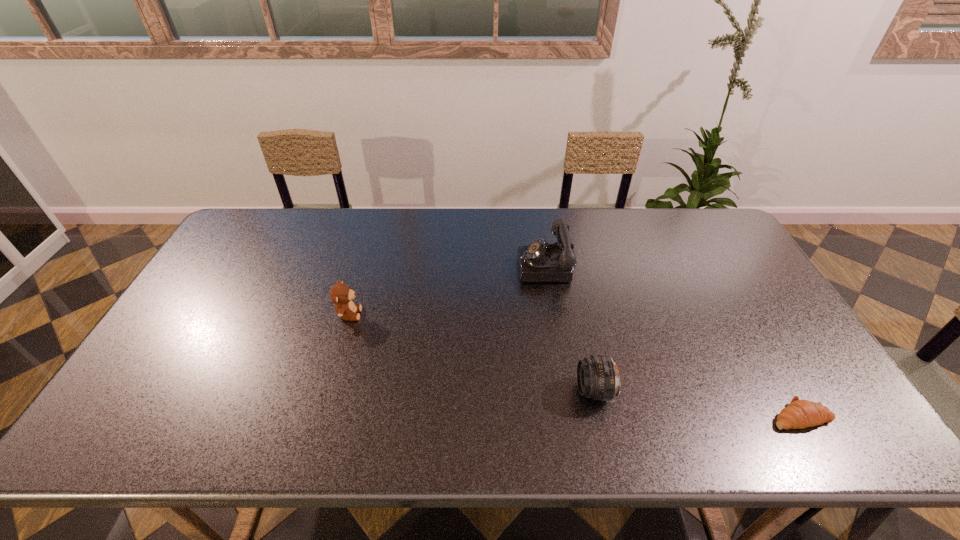
This screenshot has width=960, height=540. Find the location of `vacant space that's between the teddy bear and the tallest object`. vacant space that's between the teddy bear and the tallest object is located at coordinates (448, 290).

You are a GUI agent. You are given a task and a screenshot of the screen. Output one action in this format:
    pyautogui.click(x=<x>, y=<y>)
    Task: Click on the free space between the shortest object and the farthest object
    The height and width of the screenshot is (540, 960).
    Given the screenshot: What is the action you would take?
    pyautogui.click(x=674, y=341)

Image resolution: width=960 pixels, height=540 pixels. What are the coordinates of `vacant point located between the telephoto lens and the teddy bear` in the screenshot? It's located at (471, 352).

Find the location of a particular element. vacant area that lies between the teddy bear and the tallest object is located at coordinates (448, 290).

Identify which object is the third closest to the rightmost object. Please provide its 2D coordinates. Your answer should be formatted as a tuple, i.e. [(x, y)], where the tuple contains the x and y coordinates of a point satisfying the conditions above.

[(340, 294)]

Identify which object is located as the nearest to the farthest object. Please provide its 2D coordinates. Your answer should be formatted as a tuple, i.e. [(x, y)], where the tuple contains the x and y coordinates of a point satisfying the conditions above.

[(598, 378)]

Image resolution: width=960 pixels, height=540 pixels. In order to click on free point that satisfies the following two spatial constraints: 1. at the front element of the crescent roll; 2. on the right side of the telephoto lens in this screenshot , I will do `click(600, 416)`.

At what (x,y) coordinates should I click in order to perform the action: click on free spot that satisfies the following two spatial constraints: 1. on the face of the shortest object; 2. on the left side of the leftmost object. Please return your answer as a coordinate pair (x, y). This screenshot has width=960, height=540. Looking at the image, I should click on (320, 416).

Where is `vacant space that satisfies the following two spatial constraints: 1. on the dial of the tallest object; 2. on the back side of the crescent roll`? vacant space that satisfies the following two spatial constraints: 1. on the dial of the tallest object; 2. on the back side of the crescent roll is located at coordinates 573,416.

In order to click on vacant space that satisfies the following two spatial constraints: 1. on the dial of the tallest object; 2. on the right side of the crescent roll in this screenshot , I will do `click(573, 416)`.